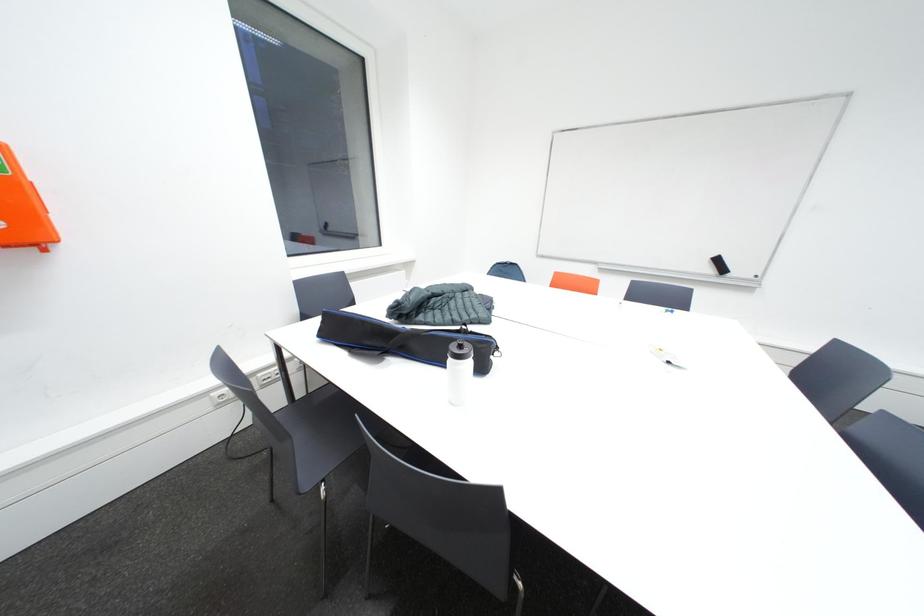
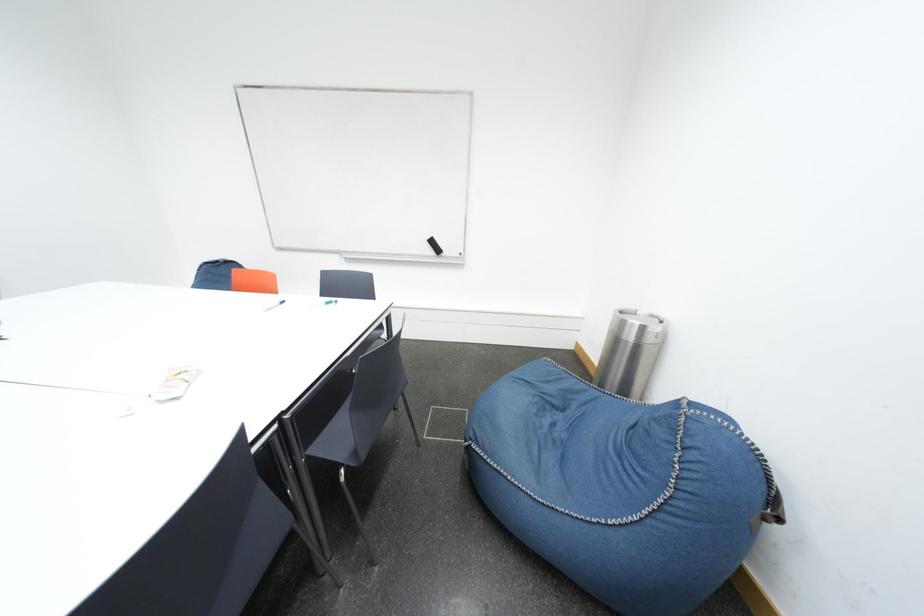
Question: What movement of the cameraman would produce the second image?

Choices:
 (A) Left
 (B) Right
 (C) Forward
 (D) Backward

Answer: (B)